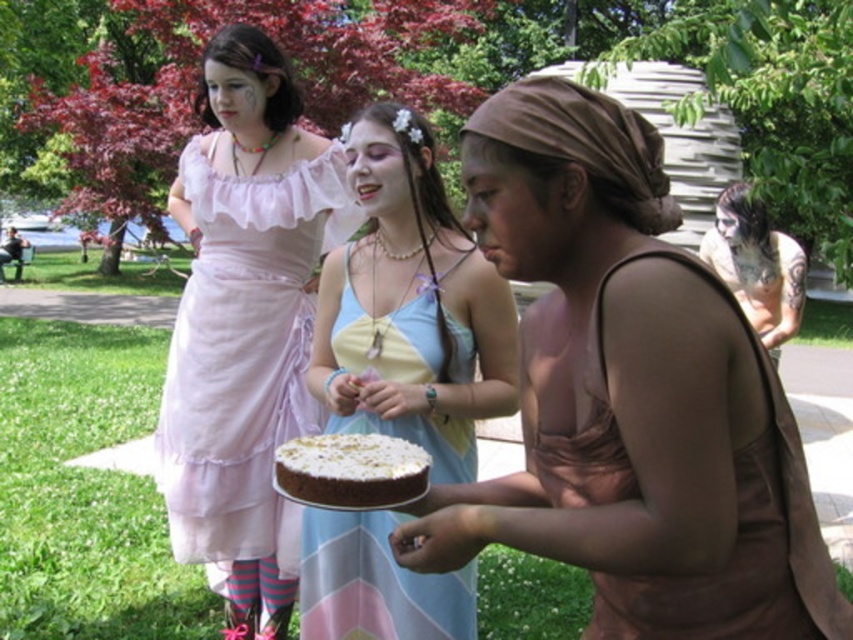
You are planning to take a photo of the shiny silver hair at upper right and the white frosted chocolate cake at center. Which object should you focus on first if you want to capture both in the same frame without moving the camera?

You should focus on the white frosted chocolate cake at center first because the shiny silver hair at upper right is positioned to its right side, so keeping the cake centered will ensure both objects are in frame.

You are taking a photo of the two points in the scene. Which point, point (599, 376) or point (634, 637), will appear larger in your photo?

Point (599, 376) is closer to the camera than point (634, 637), so it will appear larger in the photo.